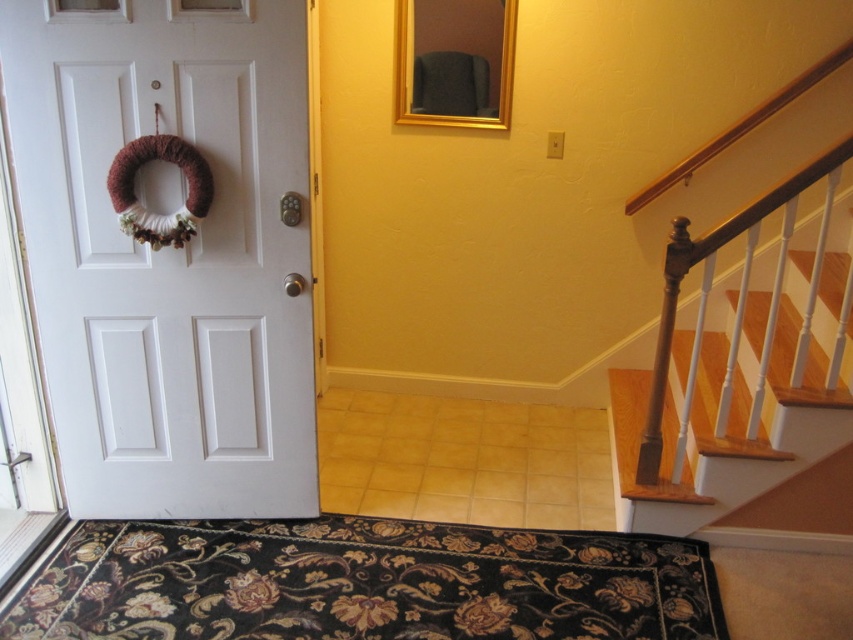
You are standing in the foyer and want to exit through the door. Are the wooden stairs at right blocking your path to the white matte door at left?

The white matte door at left is in front of the wooden stairs at right, so the stairs are behind the door and not blocking your path.

You are standing at the entrance of a home and see the black floral rug at lower center and the wooden stairs at right. Which object is closer to the entrance?

The black floral rug at lower center is closer to the entrance because it is positioned to the left of the wooden stairs at right, indicating it is nearer to the entrance area.